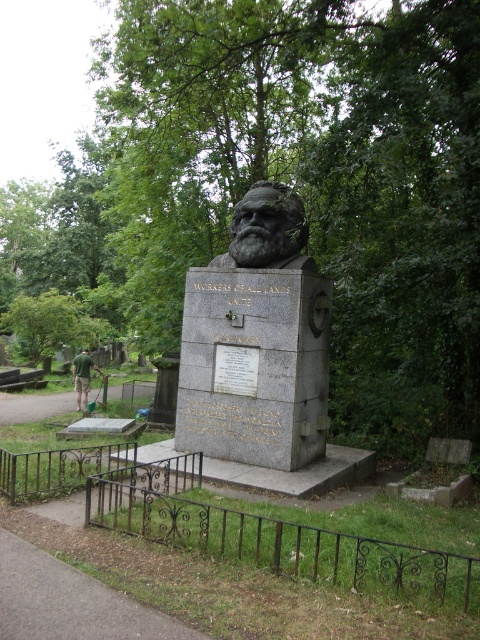
Question: Estimate the real-world distances between objects in this image. Which object is closer to the green grass at lower left?

Choices:
 (A) green stone bust at center
 (B) gray stone bust at center

Answer: (B)

Question: Which object is farther from the camera taking this photo?

Choices:
 (A) gray stone bust at center
 (B) green stone bust at center
 (C) green grass at lower left
 (D) green leafy tree at upper center

Answer: (C)

Question: Is gray stone bust at center wider than green stone bust at center?

Choices:
 (A) yes
 (B) no

Answer: (A)

Question: Does green leafy tree at upper center come in front of gray stone bust at center?

Choices:
 (A) yes
 (B) no

Answer: (A)

Question: From the image, what is the correct spatial relationship of green leafy tree at upper center in relation to green grass at lower left?

Choices:
 (A) above
 (B) below

Answer: (A)

Question: Which object is farther from the camera taking this photo?

Choices:
 (A) green leafy tree at upper center
 (B) gray stone bust at center
 (C) green stone bust at center

Answer: (C)